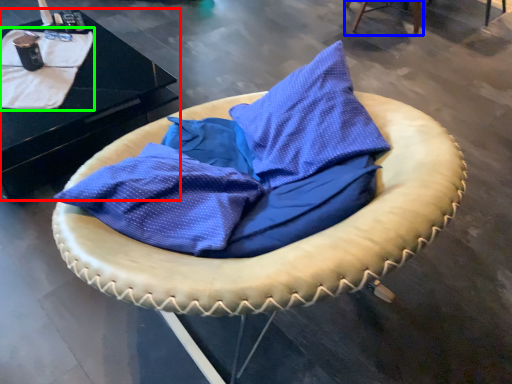
Question: Considering the real-world distances, which object is farthest from table (highlighted by a red box)? furniture (highlighted by a blue box) or blanket (highlighted by a green box)?

Choices:
 (A) furniture
 (B) blanket

Answer: (A)